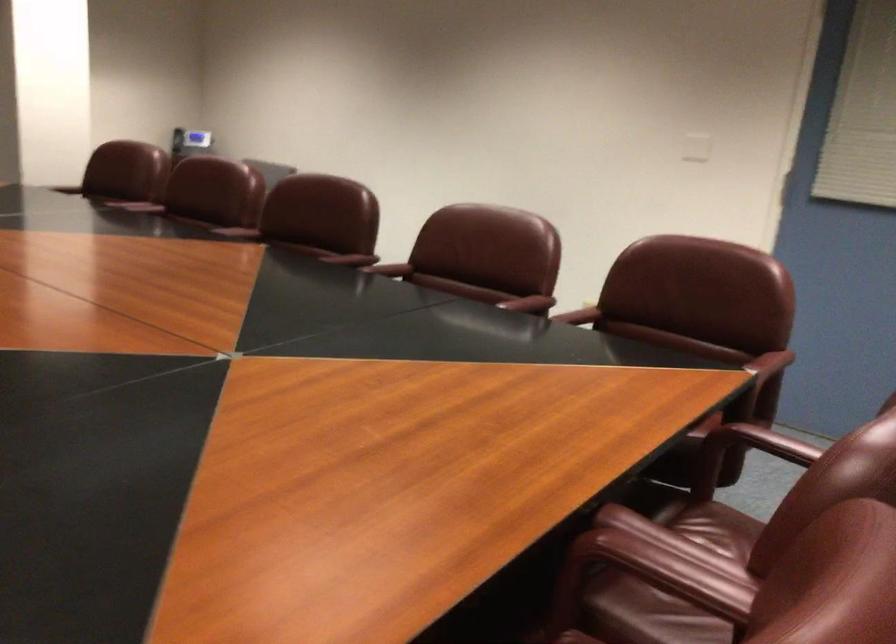
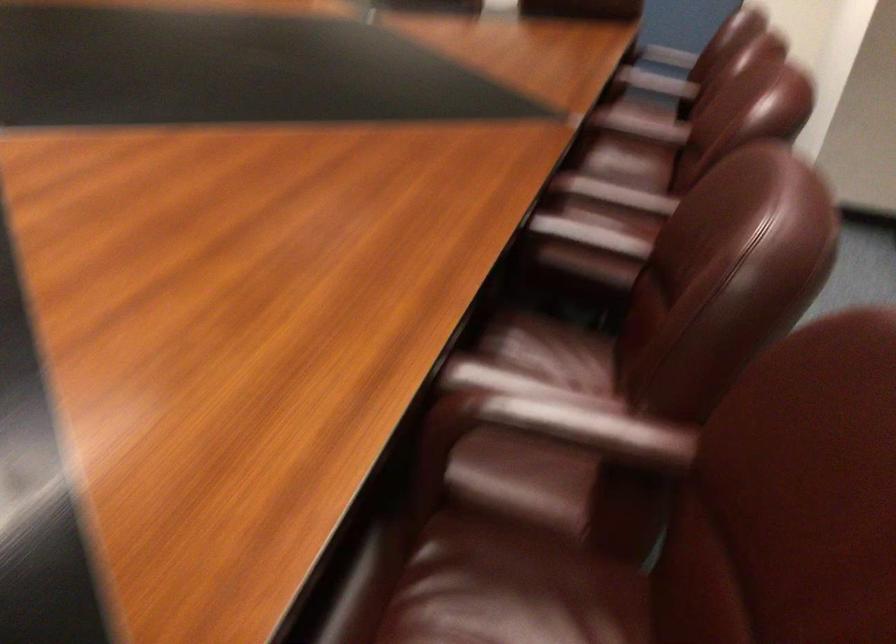
The point at [648,572] is marked in the first image. Where is the corresponding point in the second image?

(656, 82)